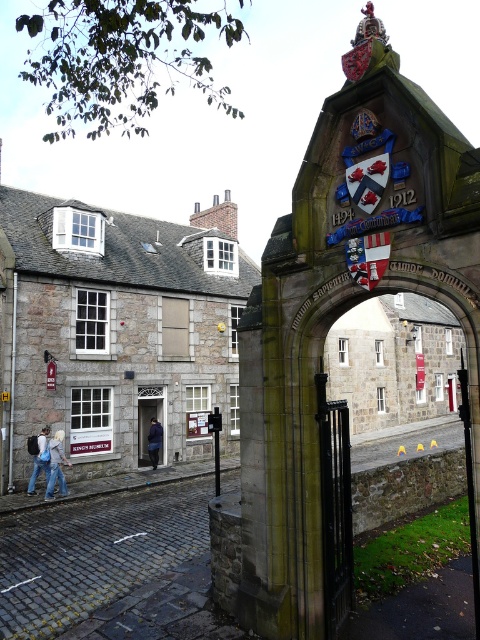
Question: Among these points, which one is farthest from the camera?

Choices:
 (A) (140, 444)
 (B) (47, 230)

Answer: (A)

Question: In this image, where is stone building at left located relative to denim jacket at lower left?

Choices:
 (A) right
 (B) left

Answer: (A)

Question: Does stone archway at center appear under dark blue fabric door at center?

Choices:
 (A) no
 (B) yes

Answer: (A)

Question: Does stone building at left have a lesser width compared to dark blue door at center?

Choices:
 (A) no
 (B) yes

Answer: (A)

Question: Which object is farther from the camera taking this photo?

Choices:
 (A) denim jeans at lower left
 (B) stone archway at center

Answer: (A)

Question: Which point is closer to the camera taking this photo?

Choices:
 (A) (36, 474)
 (B) (157, 458)
 (C) (49, 492)
 (D) (20, 301)

Answer: (C)